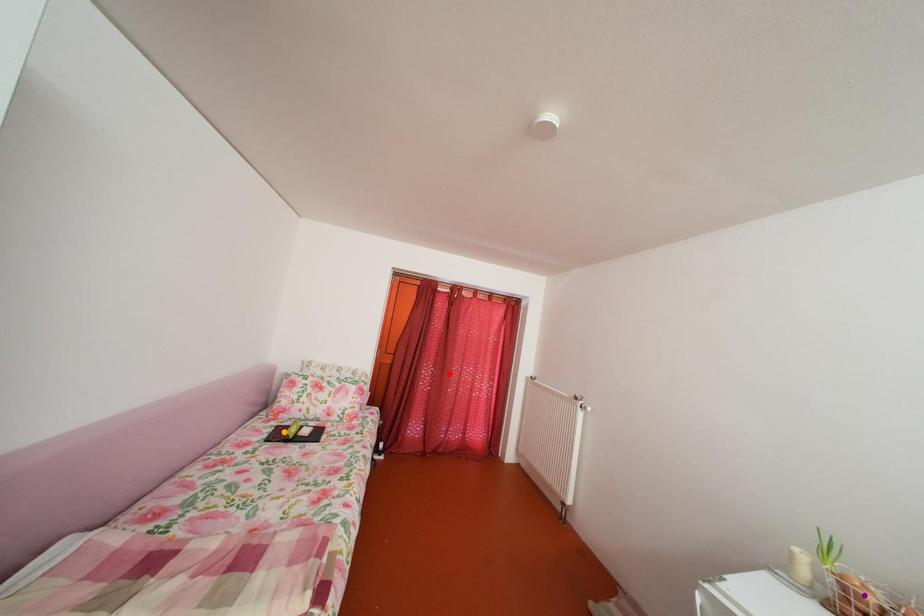
From the picture: Order these from nearest to farthest:
red point
purple point
orange point

purple point
orange point
red point